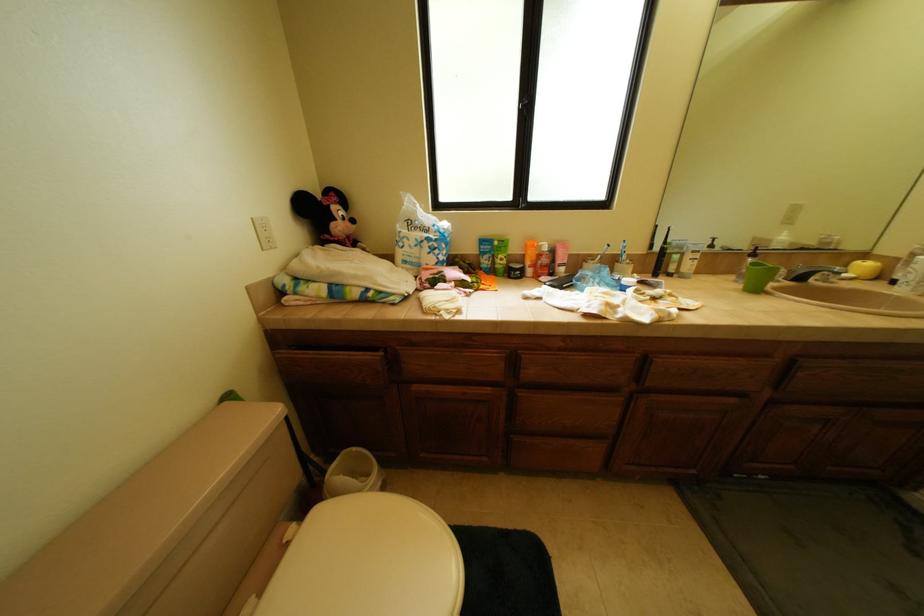
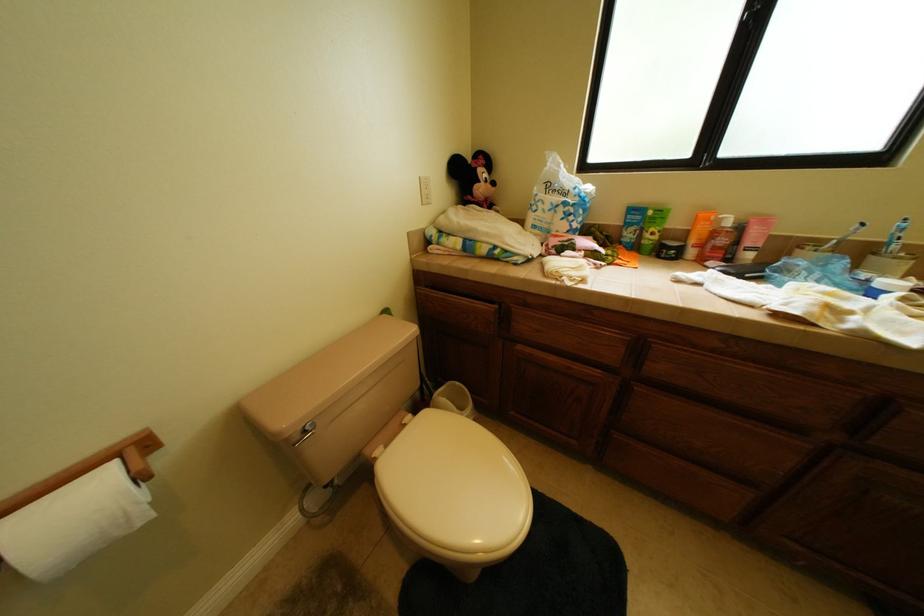
Question: The camera is either moving clockwise (left) or counter-clockwise (right) around the object. The first image is from the beginning of the video and the second image is from the end. Is the camera moving left or right when shooting the video?

Choices:
 (A) Left
 (B) Right

Answer: (B)